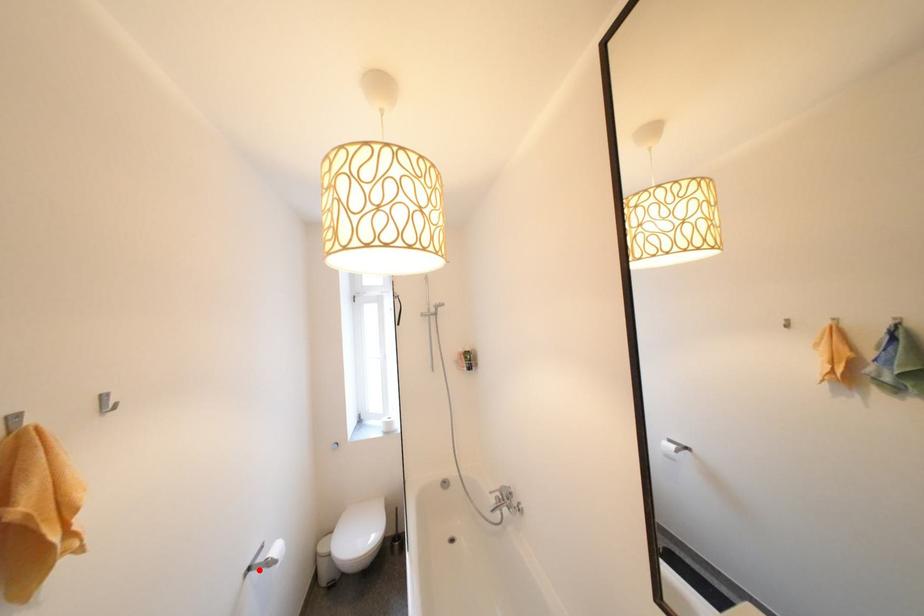
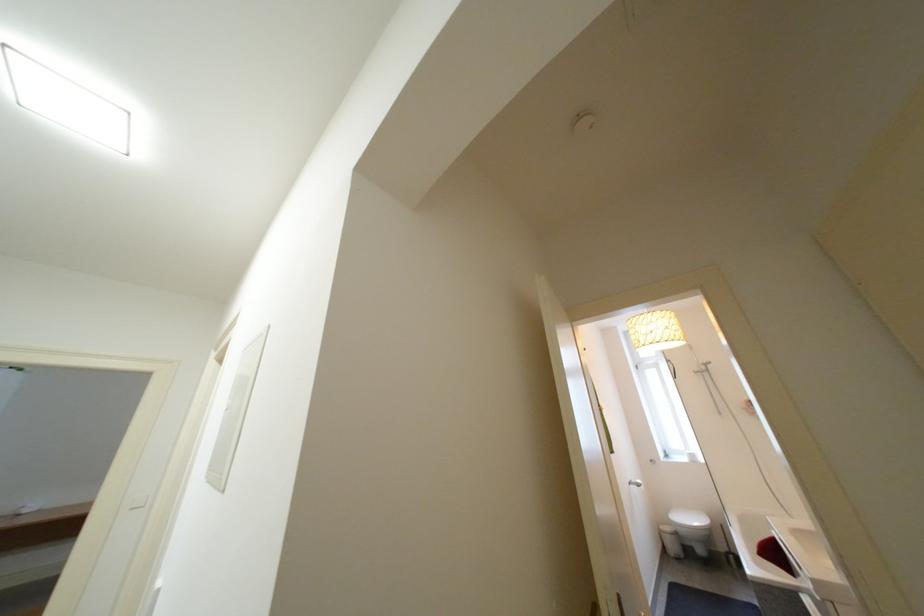
Question: I am providing you with two images of the same scene from different viewpoints. Given a red point in image1, look at the same physical point in image2. Is it:

Choices:
 (A) Closer to the viewpoint
 (B) Farther from the viewpoint

Answer: (B)